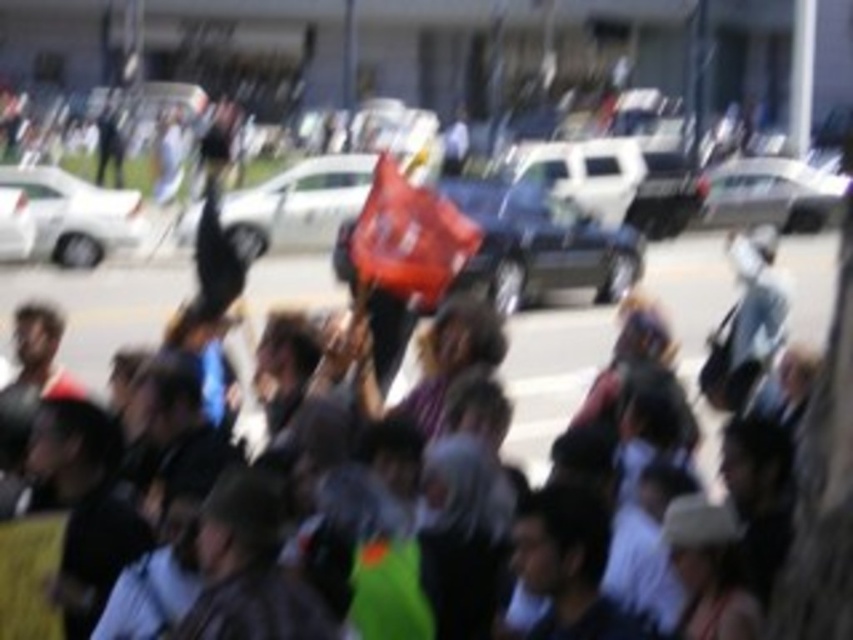
Question: Which point is farther from the camera taking this photo?

Choices:
 (A) (270, 224)
 (B) (619, 272)
 (C) (810, 214)

Answer: (C)

Question: Does matte white car at center come behind white matte car at left?

Choices:
 (A) no
 (B) yes

Answer: (B)

Question: Does metallic silver car at center appear under matte white car at center?

Choices:
 (A) no
 (B) yes

Answer: (B)

Question: Which object is farther from the camera taking this photo?

Choices:
 (A) white glossy sedan at upper right
 (B) metallic silver car at center
 (C) matte white car at center
 (D) white matte car at left

Answer: (A)

Question: In this image, where is white matte car at left located relative to white glossy sedan at upper right?

Choices:
 (A) above
 (B) below

Answer: (B)

Question: Estimate the real-world distances between objects in this image. Which object is farther from the matte white car at center?

Choices:
 (A) white glossy sedan at upper right
 (B) metallic silver car at center
 (C) white matte car at left

Answer: (A)